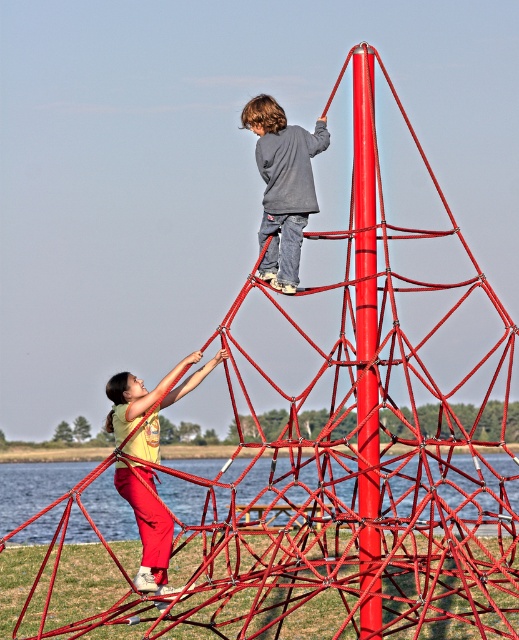
Question: From the image, what is the correct spatial relationship of glossy metal pole at upper center in relation to gray cotton shirt at upper center?

Choices:
 (A) above
 (B) below

Answer: (B)

Question: Does gray cotton shirt at upper center lie in front of matte yellow shirt at center?

Choices:
 (A) no
 (B) yes

Answer: (A)

Question: Is the position of glossy metal pole at upper center less distant than that of gray cotton shirt at upper center?

Choices:
 (A) yes
 (B) no

Answer: (A)

Question: Which point is closer to the camera?

Choices:
 (A) glossy metal pole at upper center
 (B) gray cotton shirt at upper center
 (C) matte yellow shirt at center

Answer: (C)

Question: Which object is closer to the camera taking this photo?

Choices:
 (A) glossy metal pole at upper center
 (B) matte yellow shirt at center

Answer: (B)

Question: Which point appears farthest from the camera in this image?

Choices:
 (A) (363, 330)
 (B) (129, 410)
 (C) (269, 253)

Answer: (C)